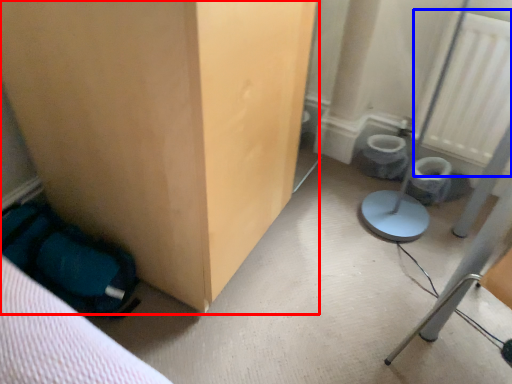
Question: Which of the following is the farthest to the observer, furniture (highlighted by a red box) or radiator (highlighted by a blue box)?

Choices:
 (A) furniture
 (B) radiator

Answer: (B)